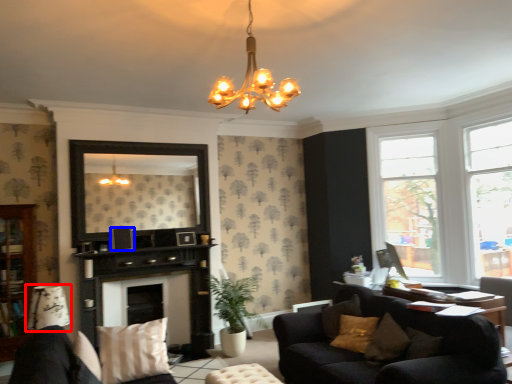
Question: Which object appears closest to the camera in this image, lamp (highlighted by a red box) or picture frame (highlighted by a blue box)?

Choices:
 (A) lamp
 (B) picture frame

Answer: (A)